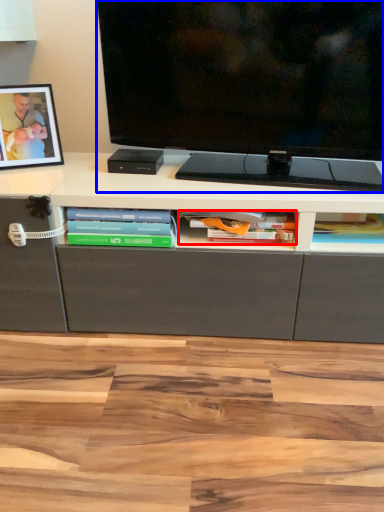
Question: Among these objects, which one is farthest to the camera, book (highlighted by a red box) or television (highlighted by a blue box)?

Choices:
 (A) book
 (B) television

Answer: (A)